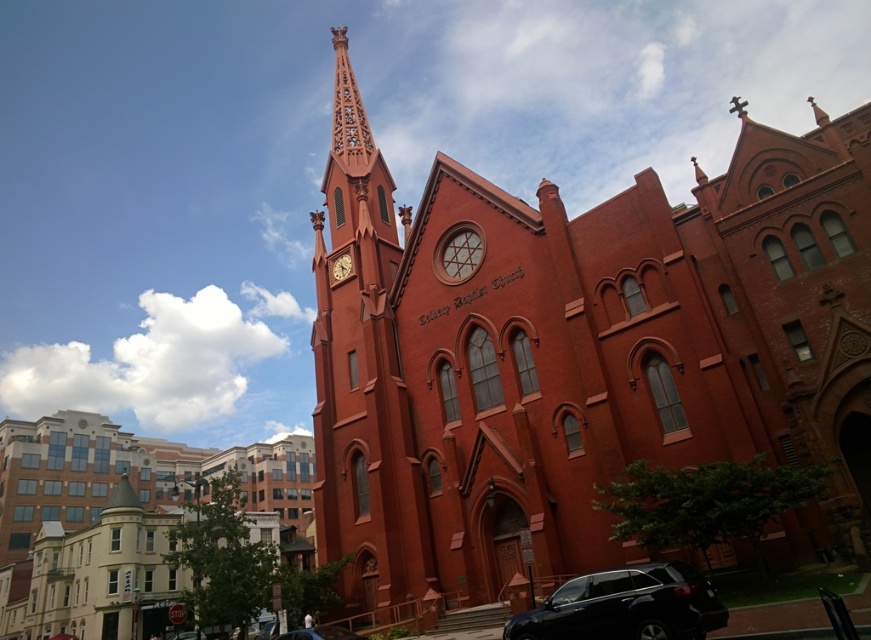
Based on the photo, you are driving a car and see the black matte suv at lower right and the matte brown clock at upper center. Which object is closer to you?

The black matte suv at lower right is closer to you because it is in front of the matte brown clock at upper center.

You are a photographer planning to take a picture of the black matte suv at lower right and the matte brown clock at upper center. Which object should you focus on first if you want to ensure both are in sharp focus?

The black matte suv at lower right is taller than the matte brown clock at upper center. To ensure both are in sharp focus, you should focus on the black matte suv at lower right first since it is larger and requires more precise focus.

You are standing in front of the red brick church and notice a point marked at coordinate (625, 605). What object is located at this coordinate?

The point at coordinate (625, 605) indicates the location of the black matte suv at lower right.